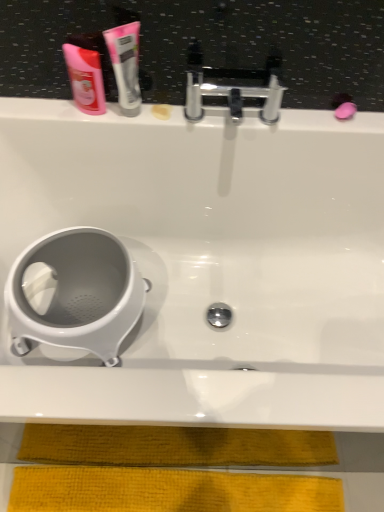
Question: Can you confirm if white plastic toilet at lower left is smaller than white glossy tube at upper center?

Choices:
 (A) yes
 (B) no

Answer: (B)

Question: From a real-world perspective, is white plastic toilet at lower left on white glossy tube at upper center?

Choices:
 (A) no
 (B) yes

Answer: (A)

Question: Is white plastic toilet at lower left bigger than white glossy tube at upper center?

Choices:
 (A) no
 (B) yes

Answer: (B)

Question: Does white plastic toilet at lower left come in front of white glossy tube at upper center?

Choices:
 (A) no
 (B) yes

Answer: (A)

Question: Can you confirm if white plastic toilet at lower left is thinner than white glossy tube at upper center?

Choices:
 (A) yes
 (B) no

Answer: (B)

Question: Looking at their shapes, would you say polished chrome faucet at upper center is wider or thinner than white glossy bathtub at center?

Choices:
 (A) wide
 (B) thin

Answer: (B)

Question: From a real-world perspective, is polished chrome faucet at upper center physically located above or below white glossy bathtub at center?

Choices:
 (A) below
 (B) above

Answer: (B)

Question: From the image's perspective, relative to white glossy bathtub at center, is polished chrome faucet at upper center above or below?

Choices:
 (A) below
 (B) above

Answer: (B)

Question: Looking at the image, does polished chrome faucet at upper center seem bigger or smaller compared to white glossy bathtub at center?

Choices:
 (A) big
 (B) small

Answer: (B)

Question: From a real-world perspective, is white plastic toilet at lower left above or below white glossy bathtub at center?

Choices:
 (A) below
 (B) above

Answer: (A)

Question: Looking at the image, does white plastic toilet at lower left seem bigger or smaller compared to white glossy bathtub at center?

Choices:
 (A) big
 (B) small

Answer: (B)

Question: In terms of height, does white plastic toilet at lower left look taller or shorter compared to white glossy bathtub at center?

Choices:
 (A) short
 (B) tall

Answer: (A)

Question: Considering their positions, is white plastic toilet at lower left located in front of or behind white glossy bathtub at center?

Choices:
 (A) front
 (B) behind

Answer: (B)

Question: From their relative heights in the image, would you say white glossy bathtub at center is taller or shorter than white plastic toilet at lower left?

Choices:
 (A) tall
 (B) short

Answer: (A)

Question: In the image, is white glossy bathtub at center positioned in front of or behind white plastic toilet at lower left?

Choices:
 (A) behind
 (B) front

Answer: (B)